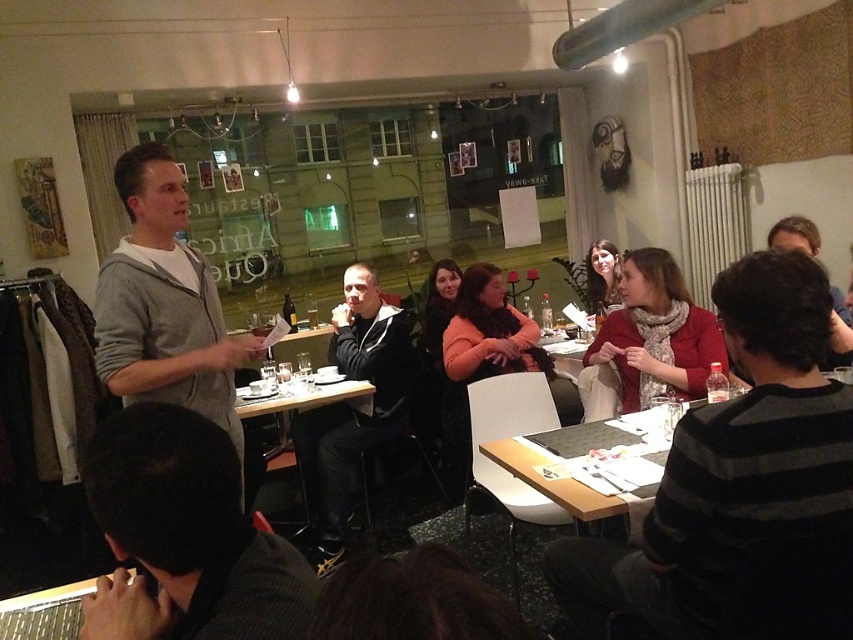
Does red scarf at center appear under matte red scarf at center?

Yes.

Is red scarf at center taller than matte red scarf at center?

Yes, red scarf at center is taller than matte red scarf at center.

The height and width of the screenshot is (640, 853). Describe the element at coordinates (740, 486) in the screenshot. I see `red scarf at center` at that location.

Where is `red scarf at center`? The width and height of the screenshot is (853, 640). red scarf at center is located at coordinates (740, 486).

Is the position of black leather jacket at center less distant than that of wooden table at center?

That is True.

Between black leather jacket at center and wooden table at center, which one is positioned higher?

wooden table at center is higher up.

Is point (328, 563) closer to viewer compared to point (347, 388)?

That is True.

Find the location of a particular element. This screenshot has height=640, width=853. black leather jacket at center is located at coordinates (352, 406).

Is dark gray striped shirt at lower left closer to the viewer compared to gray hoodie at center?

Yes, it is.

Does dark gray striped shirt at lower left appear over gray hoodie at center?

No.

The height and width of the screenshot is (640, 853). What do you see at coordinates (184, 536) in the screenshot?
I see `dark gray striped shirt at lower left` at bounding box center [184, 536].

The width and height of the screenshot is (853, 640). What are the coordinates of `dark gray striped shirt at lower left` in the screenshot? It's located at (184, 536).